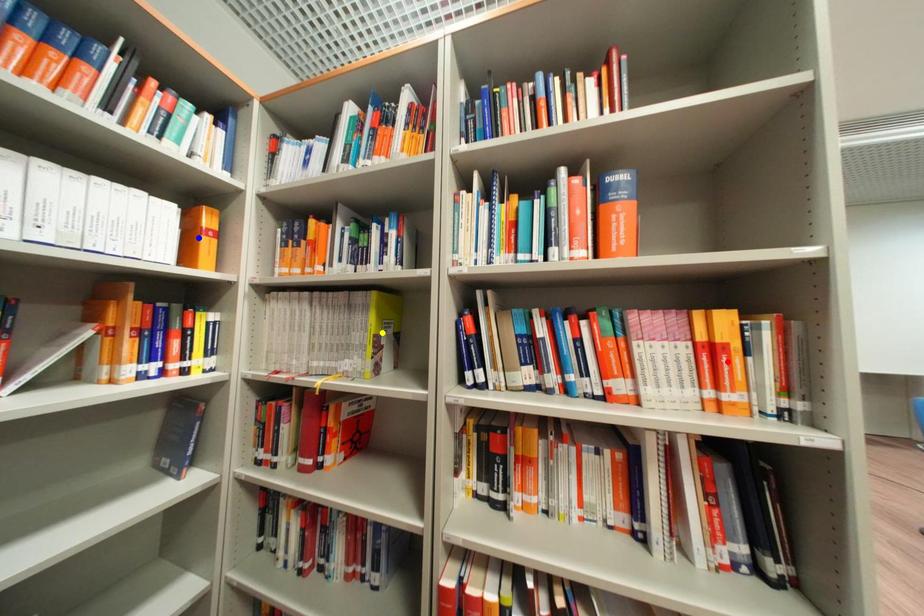
Order these from nearest to farthest:
- yellow point
- blue point
- red point

1. red point
2. blue point
3. yellow point